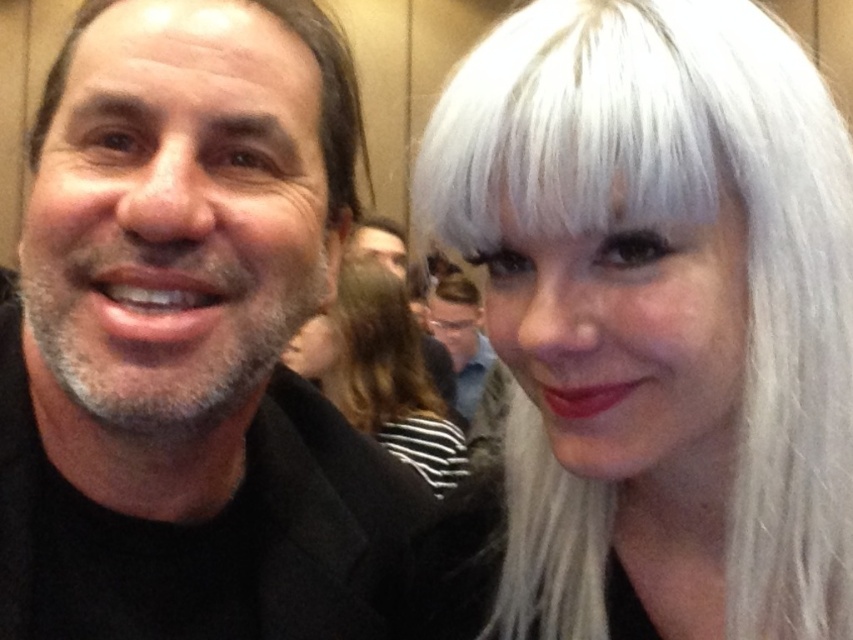
Question: Which object is farther from the camera taking this photo?

Choices:
 (A) white matte wig at center
 (B) gray matte hair at left

Answer: (A)

Question: Is matte black jacket at left positioned before matte black jacket at center?

Choices:
 (A) yes
 (B) no

Answer: (A)

Question: Which point appears closest to the camera in this image?

Choices:
 (A) [351, 349]
 (B) [326, 76]
 (C) [624, 225]
 (D) [456, 394]

Answer: (C)

Question: Does white matte wig at center have a greater width compared to gray matte hair at left?

Choices:
 (A) yes
 (B) no

Answer: (A)

Question: Can you confirm if white silky hair at right is positioned to the left of gray matte hair at left?

Choices:
 (A) yes
 (B) no

Answer: (B)

Question: Which object is positioned closest to the white silky hair at right?

Choices:
 (A) gray matte hair at left
 (B) white matte wig at center
 (C) matte black jacket at left

Answer: (C)